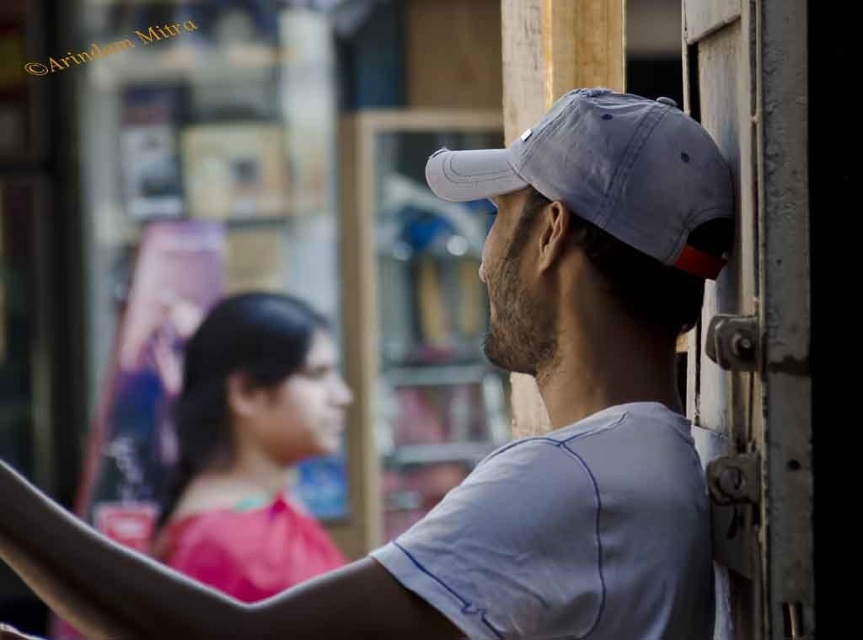
You are a photographer trying to capture a clear shot of both the gray fabric cap at upper right and the gray cotton baseball cap at upper right in the scene. Since they are both at the upper right, which one should you adjust your camera to focus on first to ensure both are in frame?

The gray fabric cap at upper right is to the left of the gray cotton baseball cap at upper right, so you should focus on the gray fabric cap at upper right first to ensure both are in frame.

You are a photographer adjusting your camera settings. You notice the gray fabric cap at upper right in the frame. Based on its position at coordinates point 0.691, 0.596, can you determine if it is positioned in the upper right quadrant of the image?

The gray fabric cap at upper right is located at point (513, 442), which falls within the upper right quadrant of the image.

You are standing at the point with coordinates point [683,115] and want to move to the point with coordinates point [721,266]. Given the street layout described in the scene, can you directly walk towards your destination without needing to go around any obstacles?

Point [683,115] is behind point [721,266], so you cannot directly walk towards your destination without going around point [721,266].